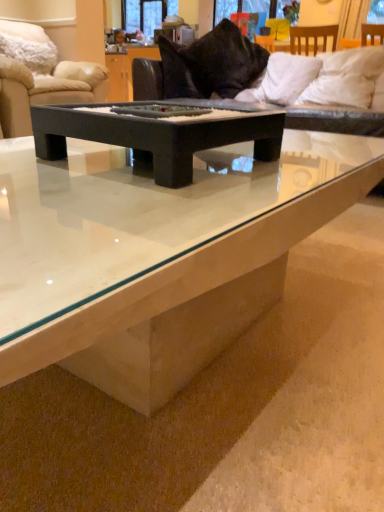
What is the approximate width of velvet black couch at upper center, which ranks as the first studio couch in right-to-left order?

3.59 feet.

This screenshot has height=512, width=384. Identify the location of beige fabric couch at upper left, which is the 2th studio couch from right to left. (45, 90).

From the image's perspective, is black velvet pillow at upper center, the second pillow in the left-to-right sequence, positioned above or below white soft pillow at upper right, which appears as the first pillow when viewed from the right?

From the image's perspective, black velvet pillow at upper center, the second pillow in the left-to-right sequence, appears above white soft pillow at upper right, which appears as the first pillow when viewed from the right.

From a real-world perspective, is black velvet pillow at upper center, the second pillow in the left-to-right sequence, positioned above or below white soft pillow at upper right, which ranks as the fourth pillow in left-to-right order?

black velvet pillow at upper center, the second pillow in the left-to-right sequence, is above white soft pillow at upper right, which ranks as the fourth pillow in left-to-right order.

Is black velvet pillow at upper center, the second pillow in the left-to-right sequence, oriented away from white soft pillow at upper right, which appears as the first pillow when viewed from the right?

No, black velvet pillow at upper center, the second pillow in the left-to-right sequence,'s orientation is not away from white soft pillow at upper right, which appears as the first pillow when viewed from the right.

Measure the distance between white soft pillow at upper right, which appears as the first pillow when viewed from the right, and white marble coffee table at center, which is counted as the 1th coffee table, starting from the bottom.

A distance of 1.72 meters exists between white soft pillow at upper right, which appears as the first pillow when viewed from the right, and white marble coffee table at center, which is counted as the 1th coffee table, starting from the bottom.

From a real-world perspective, which object stands above the other?

In real-world perspective, white soft pillow at upper right, which ranks as the fourth pillow in left-to-right order, is above.

Can you confirm if white soft pillow at upper right, which ranks as the fourth pillow in left-to-right order, is shorter than white marble coffee table at center, which is counted as the 2th coffee table, starting from the top?

Correct, white soft pillow at upper right, which ranks as the fourth pillow in left-to-right order, is not as tall as white marble coffee table at center, which is counted as the 2th coffee table, starting from the top.

Is there a large distance between white soft pillow at upper right, which ranks as the fourth pillow in left-to-right order, and white marble coffee table at center, which is counted as the 1th coffee table, starting from the bottom?

That's right, there is a large distance between white soft pillow at upper right, which ranks as the fourth pillow in left-to-right order, and white marble coffee table at center, which is counted as the 1th coffee table, starting from the bottom.

Is white soft pillow at upper right, which ranks as the fourth pillow in left-to-right order, completely or partially inside white soft pillow at upper right, the second pillow from the right?

No, white soft pillow at upper right, which ranks as the fourth pillow in left-to-right order, is located outside of white soft pillow at upper right, the second pillow from the right.

Does white soft pillow at upper right, which is the third pillow from left to right, appear on the left side of white soft pillow at upper right, which appears as the first pillow when viewed from the right?

Yes.

Can you confirm if white soft pillow at upper right, which is the third pillow from left to right, is taller than white soft pillow at upper right, which appears as the first pillow when viewed from the right?

No, white soft pillow at upper right, which is the third pillow from left to right, is not taller than white soft pillow at upper right, which appears as the first pillow when viewed from the right.

Starting from the black matte tray at center, the 2th coffee table in the bottom-to-top sequence, which pillow is the 2nd one to the right? Please provide its 2D coordinates.

[(285, 78)]

Can you confirm if white soft pillow at upper right, the second pillow from the right, is thinner than black matte tray at center, the 1th coffee table positioned from the top?

Yes, white soft pillow at upper right, the second pillow from the right, is thinner than black matte tray at center, the 1th coffee table positioned from the top.

From a real-world perspective, which is physically above, white soft pillow at upper right, which is the third pillow from left to right, or black matte tray at center, the 1th coffee table positioned from the top?

white soft pillow at upper right, which is the third pillow from left to right.

Is white soft pillow at upper right, the second pillow from the right, positioned beyond the bounds of black matte tray at center, the 1th coffee table positioned from the top?

Yes, white soft pillow at upper right, the second pillow from the right, is outside of black matte tray at center, the 1th coffee table positioned from the top.

From the image's perspective, which pillow is the 2nd one below the black velvet pillow at upper center, marked as the third pillow in a right-to-left arrangement? Please provide its 2D coordinates.

[(346, 78)]

Between white soft pillow at upper right, which ranks as the fourth pillow in left-to-right order, and black velvet pillow at upper center, marked as the third pillow in a right-to-left arrangement, which one has smaller width?

With smaller width is black velvet pillow at upper center, marked as the third pillow in a right-to-left arrangement.

Looking at this image, from a real-world perspective, is white soft pillow at upper right, which appears as the first pillow when viewed from the right, under black velvet pillow at upper center, marked as the third pillow in a right-to-left arrangement?

Yes, from a real-world perspective, white soft pillow at upper right, which appears as the first pillow when viewed from the right, is below black velvet pillow at upper center, marked as the third pillow in a right-to-left arrangement.

Between velvet black couch at upper center, which ranks as the first studio couch in right-to-left order, and black matte tray at center, the 2th coffee table in the bottom-to-top sequence, which one has less height?

Standing shorter between the two is black matte tray at center, the 2th coffee table in the bottom-to-top sequence.

Is velvet black couch at upper center, which ranks as the first studio couch in right-to-left order, looking in the opposite direction of black matte tray at center, the 1th coffee table positioned from the top?

No, velvet black couch at upper center, which ranks as the first studio couch in right-to-left order,'s orientation is not away from black matte tray at center, the 1th coffee table positioned from the top.

Considering the relative sizes of velvet black couch at upper center, which ranks as the first studio couch in right-to-left order, and black matte tray at center, the 1th coffee table positioned from the top, in the image provided, is velvet black couch at upper center, which ranks as the first studio couch in right-to-left order, bigger than black matte tray at center, the 1th coffee table positioned from the top,?

Yes, velvet black couch at upper center, which ranks as the first studio couch in right-to-left order, is bigger than black matte tray at center, the 1th coffee table positioned from the top.

Who is shorter, matte glass window screen at upper center, which is the first window screen from right to left, or velvet black couch at upper center, which ranks as the first studio couch in right-to-left order?

matte glass window screen at upper center, which is the first window screen from right to left, is shorter.

What's the angular difference between matte glass window screen at upper center, which is the first window screen from right to left, and velvet black couch at upper center, which ranks as the first studio couch in right-to-left order,'s facing directions?

0.206 degrees separate the facing orientations of matte glass window screen at upper center, which is the first window screen from right to left, and velvet black couch at upper center, which ranks as the first studio couch in right-to-left order.

Could you tell me if matte glass window screen at upper center, the second window screen in the back-to-front sequence, is facing velvet black couch at upper center, which ranks as the first studio couch in right-to-left order?

Yes, matte glass window screen at upper center, the second window screen in the back-to-front sequence, is aimed at velvet black couch at upper center, which ranks as the first studio couch in right-to-left order.

Where is `pillow that is the 2nd object located in front of the black velvet pillow at upper center, the second pillow in the left-to-right sequence`? This screenshot has height=512, width=384. pillow that is the 2nd object located in front of the black velvet pillow at upper center, the second pillow in the left-to-right sequence is located at coordinates (346, 78).

This screenshot has width=384, height=512. In order to click on the 1st pillow positioned above the white marble coffee table at center, which is counted as the 1th coffee table, starting from the bottom (from the image's perspective) in this screenshot , I will do `click(346, 78)`.

Looking at the image, which one is located further to white marble coffee table at center, which is counted as the 2th coffee table, starting from the top, transparent glass window screen at upper center, placed as the 1th window screen when sorted from back to front, or beige fabric couch at upper left, which is the 2th studio couch from right to left?

transparent glass window screen at upper center, placed as the 1th window screen when sorted from back to front, is further to white marble coffee table at center, which is counted as the 2th coffee table, starting from the top.

Estimate the real-world distances between objects in this image. Which object is further from white fluffy pillow at upper left, the 1th pillow positioned from the left, velvet black couch at upper center, which ranks as the first studio couch in right-to-left order, or black matte tray at center, the 2th coffee table in the bottom-to-top sequence?

Based on the image, black matte tray at center, the 2th coffee table in the bottom-to-top sequence, appears to be further to white fluffy pillow at upper left, the 1th pillow positioned from the left.

Which object lies further to the anchor point beige fabric couch at upper left, which is the 2th studio couch from right to left, white fluffy pillow at upper left, the 1th pillow positioned from the left, or matte glass window screen at upper center, which is the first window screen from right to left?

matte glass window screen at upper center, which is the first window screen from right to left, lies further to beige fabric couch at upper left, which is the 2th studio couch from right to left, than the other object.

Considering their positions, is white marble coffee table at center, which is counted as the 1th coffee table, starting from the bottom, positioned further to white soft pillow at upper right, the second pillow from the right, than matte glass window screen at upper center, arranged as the 2th window screen when viewed from the left?

white marble coffee table at center, which is counted as the 1th coffee table, starting from the bottom, is positioned further to the anchor white soft pillow at upper right, the second pillow from the right.

Which object lies nearer to the anchor point black matte tray at center, the 2th coffee table in the bottom-to-top sequence, white fluffy pillow at upper left, placed as the fourth pillow when sorted from right to left, or white soft pillow at upper right, the second pillow from the right?

white soft pillow at upper right, the second pillow from the right, is positioned closer to the anchor black matte tray at center, the 2th coffee table in the bottom-to-top sequence.

Which object lies nearer to the anchor point transparent glass window screen at upper center, placed as the 1th window screen when sorted from back to front, beige fabric couch at upper left, which is counted as the 1th studio couch, starting from the left, or white soft pillow at upper right, the second pillow from the right?

beige fabric couch at upper left, which is counted as the 1th studio couch, starting from the left, lies closer to transparent glass window screen at upper center, placed as the 1th window screen when sorted from back to front, than the other object.

Looking at this image, which object lies further to the anchor point white soft pillow at upper right, which appears as the first pillow when viewed from the right, transparent glass window screen at upper center, arranged as the second window screen when viewed from the right, or black velvet pillow at upper center, the second pillow in the left-to-right sequence?

transparent glass window screen at upper center, arranged as the second window screen when viewed from the right, is further to white soft pillow at upper right, which appears as the first pillow when viewed from the right.

When comparing their distances from black matte tray at center, the 2th coffee table in the bottom-to-top sequence, does white fluffy pillow at upper left, the 1th pillow positioned from the left, or black velvet pillow at upper center, marked as the third pillow in a right-to-left arrangement, seem further?

white fluffy pillow at upper left, the 1th pillow positioned from the left.

Identify the location of studio couch between black matte tray at center, the 2th coffee table in the bottom-to-top sequence, and white soft pillow at upper right, which is the third pillow from left to right, in the front-back direction. (339, 121).

Locate an element on the screen. The image size is (384, 512). pillow located between black velvet pillow at upper center, marked as the third pillow in a right-to-left arrangement, and transparent glass window screen at upper center, which is the second window screen in front-to-back order, in the depth direction is located at coordinates (30, 49).

Locate an element on the screen. pillow located between beige fabric couch at upper left, which is counted as the 1th studio couch, starting from the left, and matte glass window screen at upper center, the second window screen in the back-to-front sequence, in the depth direction is located at coordinates (30, 49).

This screenshot has height=512, width=384. In order to click on pillow positioned between velvet black couch at upper center, which appears as the second studio couch when viewed from the left, and white soft pillow at upper right, which is the third pillow from left to right, from near to far in this screenshot , I will do `click(346, 78)`.